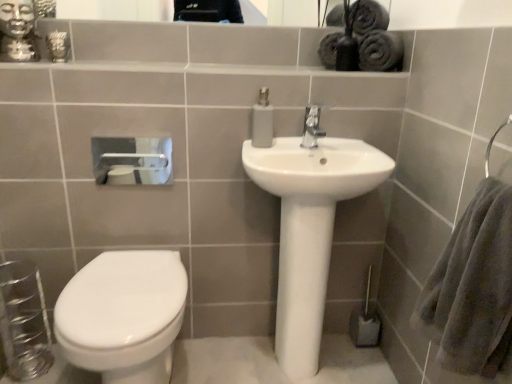
At what (x,y) coordinates should I click in order to perform the action: click on free point above white glossy toilet at lower left (from a real-world perspective). Please return your answer as a coordinate pair (x, y). Looking at the image, I should click on (124, 272).